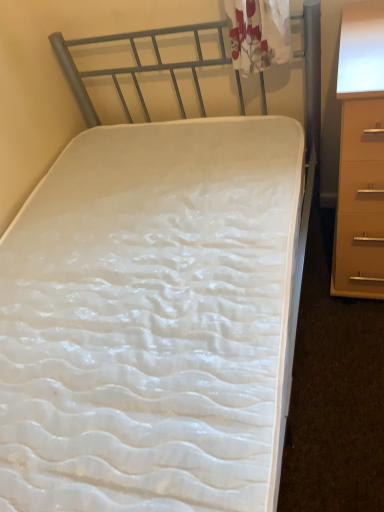
Question: Should I look upward or downward to see beige wood chest of drawers at right?

Choices:
 (A) down
 (B) up

Answer: (B)